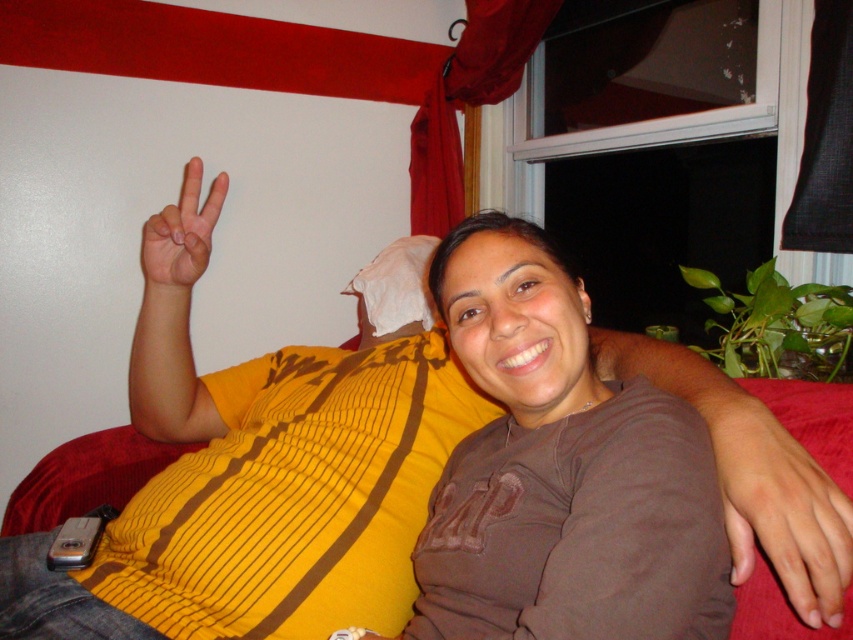
You are a photographer setting up for a group photo. You need to ensure that both the brown soft shirt at center and the matte yellow hand at upper left are clearly visible in the frame. Given their sizes, which object should you focus on to ensure proper exposure and sharpness?

The brown soft shirt at center is larger in size than the matte yellow hand at upper left, so you should focus on the brown soft shirt at center to ensure proper exposure and sharpness since it occupies more space in the frame.

You are a photographer setting up a shot of two people on a red couch. You need to ensure that the brown soft shirt at center and the pale skin hand at center are both visible in the frame. Given their sizes, which object should you prioritize positioning closer to the edge of the frame to avoid cropping?

The brown soft shirt at center is wider than the pale skin hand at center, so you should prioritize positioning the pale skin hand at center closer to the edge of the frame to avoid cropping.

You are a photographer setting up for a group photo. You need to ensure that both hands are visible in the frame. Given that the pale skin hand at center and the matte yellow hand at upper left are part of the composition, which hand might require more space in the frame due to its size?

The pale skin hand at center might require more space in the frame because it is wider than the matte yellow hand at upper left according to the description.